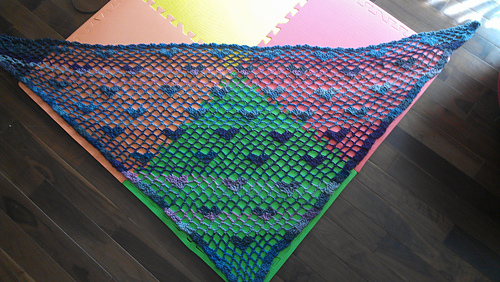
At what (x,y) coordinates should I click in order to perform the action: click on prange tile. Please return your answer as a coordinate pair (x, y). Looking at the image, I should click on (120, 31).